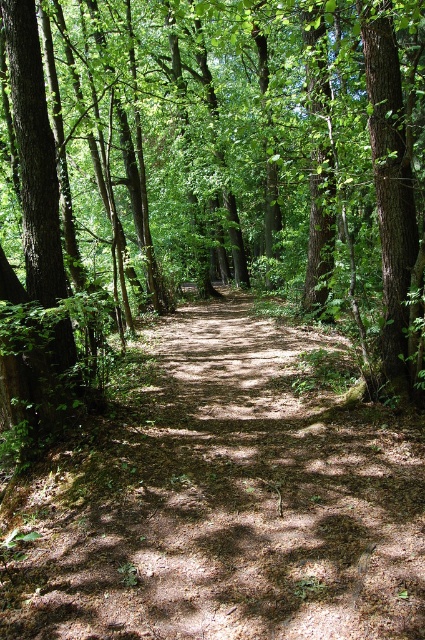
Which is above, brown textured tree at center or dirt path at center?

Positioned higher is brown textured tree at center.

Can you confirm if brown textured tree at center is positioned below dirt path at center?

Incorrect, brown textured tree at center is not positioned below dirt path at center.

The image size is (425, 640). What are the coordinates of `brown textured tree at center` in the screenshot? It's located at (266, 145).